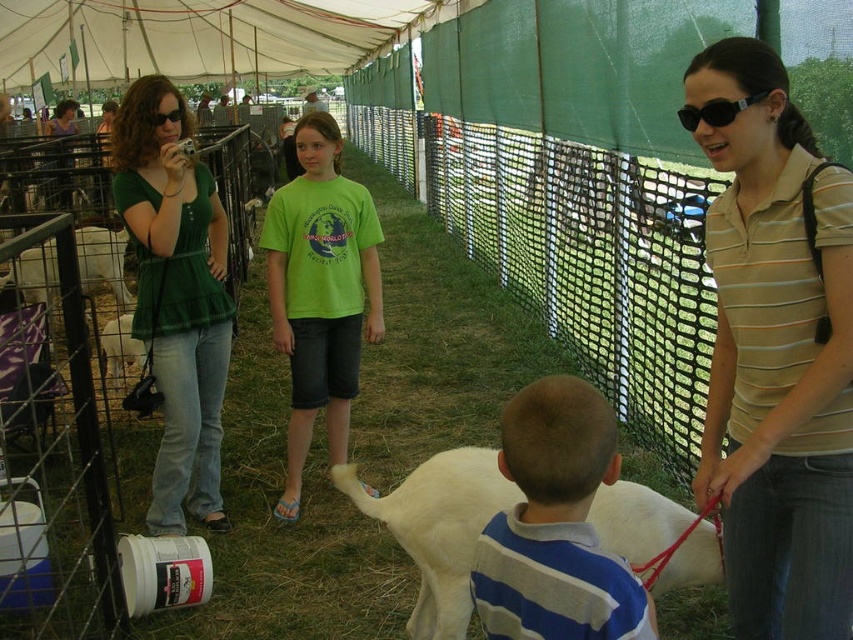
Question: Which object appears farthest from the camera in this image?

Choices:
 (A) black plastic goggles at upper center
 (B) black plastic goggles at upper left
 (C) white woolen goat at center

Answer: (B)

Question: From the image, what is the correct spatial relationship of beige striped shirt at center right in relation to black plastic goggles at upper left?

Choices:
 (A) below
 (B) above

Answer: (A)

Question: Is white woolen sheep at lower center in front of black plastic goggles at upper left?

Choices:
 (A) no
 (B) yes

Answer: (B)

Question: Is beige striped shirt at center right to the left of green plaid shirt at left from the viewer's perspective?

Choices:
 (A) no
 (B) yes

Answer: (A)

Question: Among these points, which one is farthest from the camera?

Choices:
 (A) (714, 545)
 (B) (759, 353)

Answer: (A)

Question: Which point is closer to the camera?

Choices:
 (A) white woolen sheep at lower center
 (B) beige striped shirt at center right
 (C) white canvas tent at upper center
 (D) green cotton shirt at center

Answer: (A)